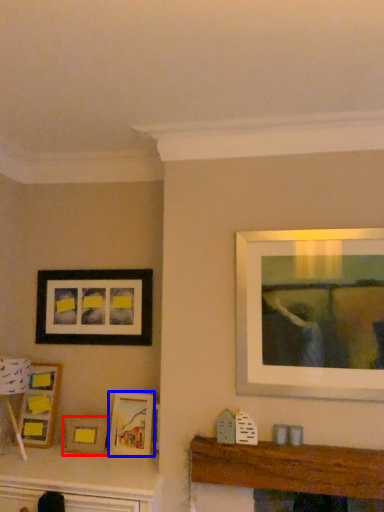
Question: Which object appears closest to the camera in this image, picture frame (highlighted by a red box) or picture frame (highlighted by a blue box)?

Choices:
 (A) picture frame
 (B) picture frame

Answer: (B)